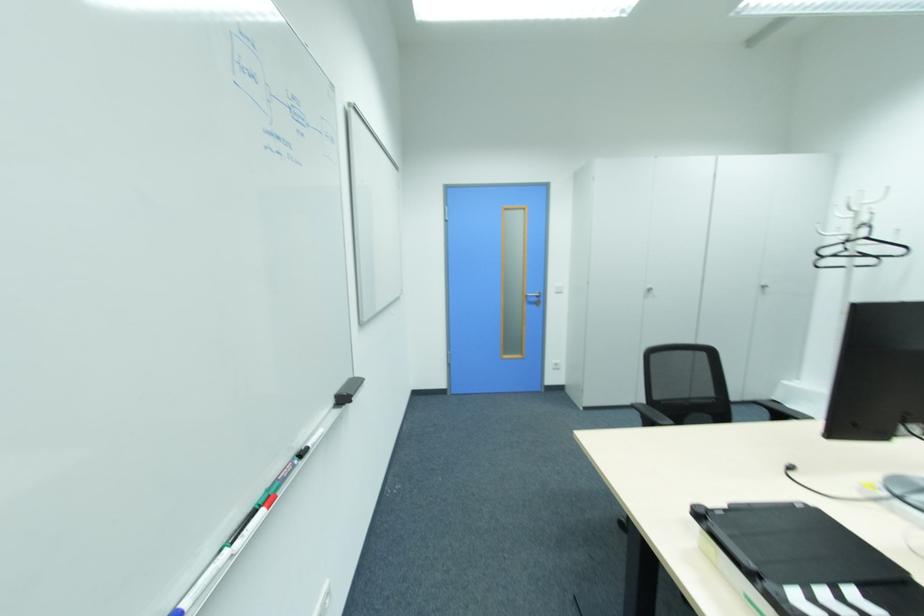
Describe the element at coordinates (533, 298) in the screenshot. I see `a silver door handle` at that location.